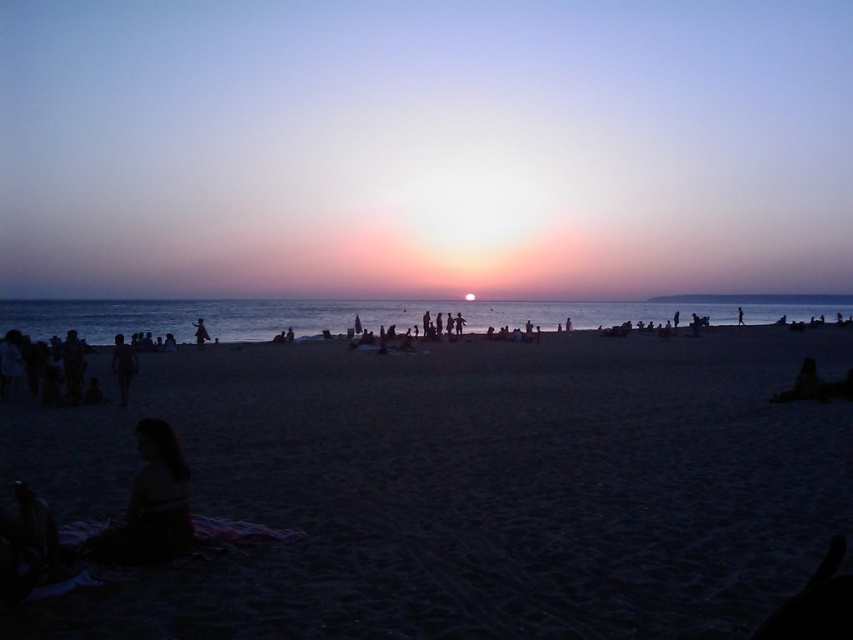
How distant is dark sand at center from silhouette figure at center?

dark sand at center is 29.83 meters from silhouette figure at center.

Can you confirm if dark sand at center is wider than silhouette figure at center?

Indeed, dark sand at center has a greater width compared to silhouette figure at center.

Find the location of `dark sand at center`. dark sand at center is located at coordinates (465, 488).

Does silhouette human at center have a greater width compared to silhouette figure at center?

Yes, silhouette human at center is wider than silhouette figure at center.

Looking at this image, can you confirm if silhouette human at center is positioned to the right of silhouette figure at center?

Correct, you'll find silhouette human at center to the right of silhouette figure at center.

Image resolution: width=853 pixels, height=640 pixels. Describe the element at coordinates (123, 365) in the screenshot. I see `silhouette human at center` at that location.

Locate an element on the screen. The image size is (853, 640). silhouette human at center is located at coordinates (123, 365).

Looking at this image, is dark sand at center to the left of silhouette human at center from the viewer's perspective?

In fact, dark sand at center is to the right of silhouette human at center.

Is dark sand at center behind silhouette human at center?

No, it is not.

What do you see at coordinates (465, 488) in the screenshot?
I see `dark sand at center` at bounding box center [465, 488].

Identify the location of dark sand at center. (465, 488).